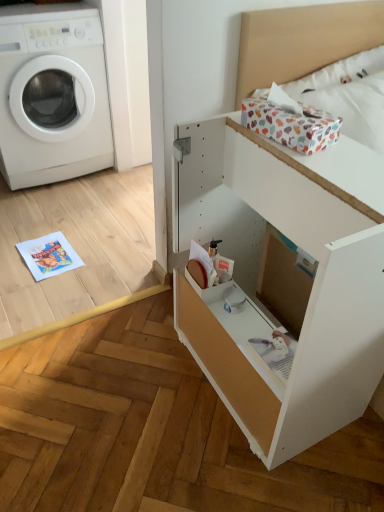
Question: Considering their positions, is white cotton bedding at upper right located in front of or behind white plastic washing machine at left?

Choices:
 (A) front
 (B) behind

Answer: (A)

Question: Based on their positions, is white cotton bedding at upper right located to the left or right of white plastic washing machine at left?

Choices:
 (A) right
 (B) left

Answer: (A)

Question: Estimate the real-world distances between objects in this image. Which object is farther from the white cotton bedding at upper right?

Choices:
 (A) white plastic washing machine at left
 (B) white matte file cabinet at center

Answer: (A)

Question: Which of these objects is positioned farthest from the white matte file cabinet at center?

Choices:
 (A) white plastic washing machine at left
 (B) white cotton bedding at upper right

Answer: (A)